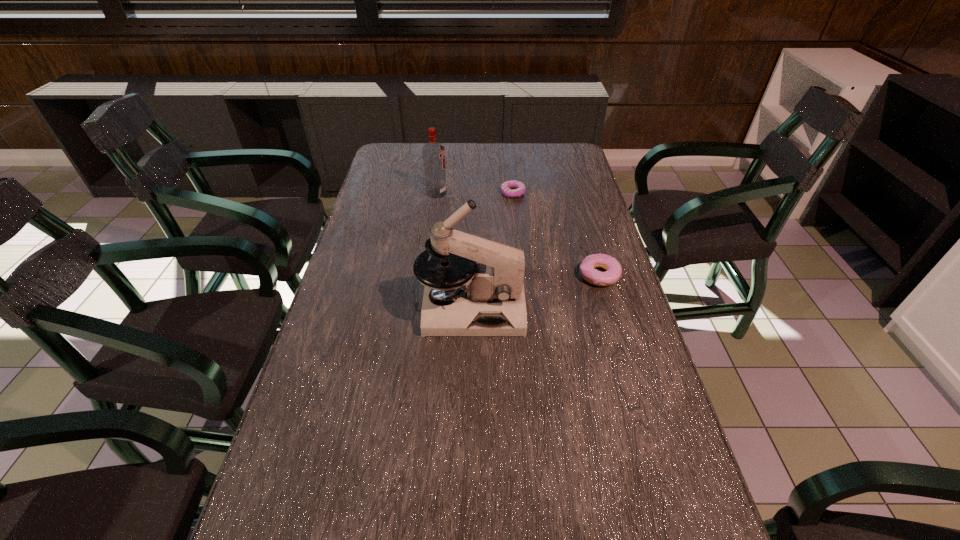
Where is `object that is the third closest to the microscope`? object that is the third closest to the microscope is located at coordinates (433, 153).

At what (x,y) coordinates should I click in order to perform the action: click on free spot that satisfies the following two spatial constraints: 1. on the front label of the vodka; 2. on the back side of the farther doughnut. Please return your answer as a coordinate pair (x, y). Looking at the image, I should click on (437, 193).

This screenshot has width=960, height=540. I want to click on vacant space that satisfies the following two spatial constraints: 1. on the front side of the third tallest object; 2. at the eyepiece of the tallest object, so click(609, 309).

The width and height of the screenshot is (960, 540). I want to click on vacant area in the image that satisfies the following two spatial constraints: 1. on the front label of the vodka; 2. on the back side of the taller doughnut, so click(426, 275).

You are a GUI agent. You are given a task and a screenshot of the screen. Output one action in this format:
    pyautogui.click(x=<x>, y=<y>)
    Task: Click on the vacant point that satisfies the following two spatial constraints: 1. on the front label of the third shortest object; 2. on the right side of the third tallest object
    This screenshot has width=960, height=540.
    Given the screenshot: What is the action you would take?
    pyautogui.click(x=426, y=275)

Locate an element on the screen. The image size is (960, 540). vacant space that satisfies the following two spatial constraints: 1. on the front side of the nearer doughnut; 2. on the right side of the shortest object is located at coordinates (521, 275).

This screenshot has width=960, height=540. What are the coordinates of `vacant point that satisfies the following two spatial constraints: 1. on the front label of the vodka; 2. on the right side of the shortest object` in the screenshot? It's located at (437, 193).

Where is `vacant position in the image that satisfies the following two spatial constraints: 1. on the front label of the vodka; 2. on the left side of the shortest object`? This screenshot has width=960, height=540. vacant position in the image that satisfies the following two spatial constraints: 1. on the front label of the vodka; 2. on the left side of the shortest object is located at coordinates pyautogui.click(x=437, y=193).

Where is `free space that satisfies the following two spatial constraints: 1. on the front label of the taller doughnut; 2. on the left side of the vodka`? The image size is (960, 540). free space that satisfies the following two spatial constraints: 1. on the front label of the taller doughnut; 2. on the left side of the vodka is located at coordinates (426, 275).

The width and height of the screenshot is (960, 540). Find the location of `free space in the image that satisfies the following two spatial constraints: 1. on the back side of the farther doughnut; 2. on the front label of the third shortest object`. free space in the image that satisfies the following two spatial constraints: 1. on the back side of the farther doughnut; 2. on the front label of the third shortest object is located at coordinates (513, 193).